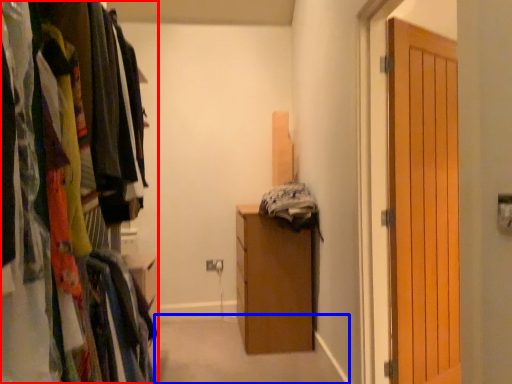
Question: Which of the following is the farthest to the observer, cabinetry (highlighted by a red box) or path (highlighted by a blue box)?

Choices:
 (A) cabinetry
 (B) path

Answer: (B)